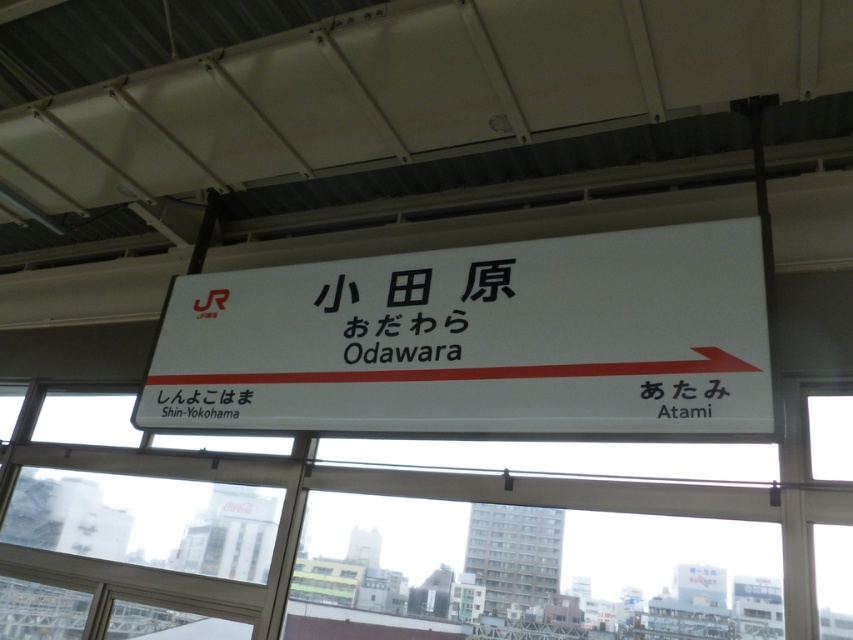
Question: Is white plastic sign at center below transparent glass window at center?

Choices:
 (A) yes
 (B) no

Answer: (B)

Question: Is white plastic sign at center positioned behind transparent glass window at center?

Choices:
 (A) no
 (B) yes

Answer: (A)

Question: Which point is closer to the camera taking this photo?

Choices:
 (A) (527, 544)
 (B) (445, 323)

Answer: (B)

Question: Observing the image, what is the correct spatial positioning of white plastic sign at center in reference to transparent glass window at center?

Choices:
 (A) left
 (B) right

Answer: (A)

Question: Which point appears farthest from the camera in this image?

Choices:
 (A) (486, 561)
 (B) (604, 420)

Answer: (A)